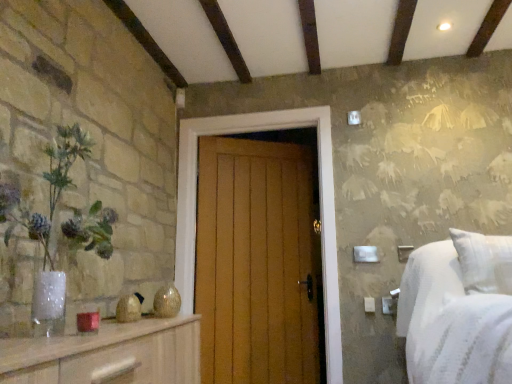
The height and width of the screenshot is (384, 512). What do you see at coordinates (288, 152) in the screenshot?
I see `wooden door at center` at bounding box center [288, 152].

In order to face wooden door at center, should I rotate leftwards or rightwards?

To face it directly, rotate left by 0.503 degrees.

Locate an element on the screen. wooden door at center is located at coordinates (288, 152).

In order to click on wooden door at center in this screenshot , I will do `click(288, 152)`.